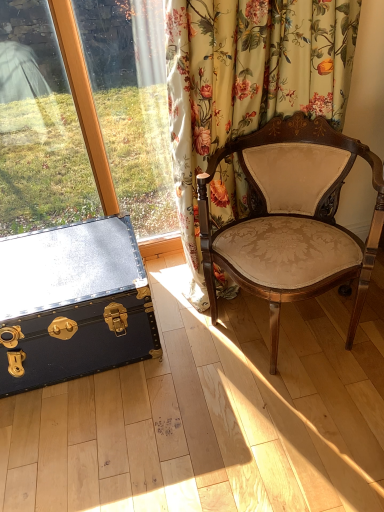
Question: Looking at the image, does velvet beige chair at center seem bigger or smaller compared to floral fabric curtain at upper right?

Choices:
 (A) small
 (B) big

Answer: (B)

Question: Choose the correct answer: Is velvet beige chair at center inside floral fabric curtain at upper right or outside it?

Choices:
 (A) inside
 (B) outside

Answer: (B)

Question: Based on their relative distances, which object is farther from the floral fabric curtain at upper right?

Choices:
 (A) velvet beige chair at center
 (B) black leather trunk at lower left

Answer: (B)

Question: Which of these objects is positioned closest to the velvet beige chair at center?

Choices:
 (A) floral fabric curtain at upper right
 (B) black leather trunk at lower left

Answer: (A)